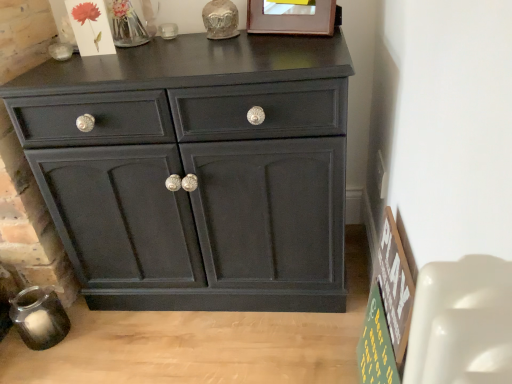
Question: Are wooden picture frame at upper center and matte black cabinet at center located far from each other?

Choices:
 (A) no
 (B) yes

Answer: (A)

Question: Considering the relative sizes of wooden picture frame at upper center and matte black cabinet at center in the image provided, is wooden picture frame at upper center wider than matte black cabinet at center?

Choices:
 (A) no
 (B) yes

Answer: (A)

Question: Is the position of wooden picture frame at upper center less distant than that of matte black cabinet at center?

Choices:
 (A) no
 (B) yes

Answer: (A)

Question: Is wooden picture frame at upper center located outside matte black cabinet at center?

Choices:
 (A) no
 (B) yes

Answer: (B)

Question: Does wooden picture frame at upper center contain matte black cabinet at center?

Choices:
 (A) yes
 (B) no

Answer: (B)

Question: Is wooden picture frame at upper center in front of or behind matte black cabinet at center in the image?

Choices:
 (A) front
 (B) behind

Answer: (B)

Question: Is wooden picture frame at upper center inside or outside of matte black cabinet at center?

Choices:
 (A) inside
 (B) outside

Answer: (B)

Question: From a real-world perspective, relative to matte black cabinet at center, is wooden picture frame at upper center vertically above or below?

Choices:
 (A) below
 (B) above

Answer: (B)

Question: From the image's perspective, is wooden picture frame at upper center positioned above or below matte black cabinet at center?

Choices:
 (A) above
 (B) below

Answer: (A)

Question: Considering the positions of green wooden signboard at lower right and wooden picture frame at upper center in the image, is green wooden signboard at lower right wider or thinner than wooden picture frame at upper center?

Choices:
 (A) wide
 (B) thin

Answer: (B)

Question: Looking at the image, does green wooden signboard at lower right seem bigger or smaller compared to wooden picture frame at upper center?

Choices:
 (A) small
 (B) big

Answer: (B)

Question: Considering the relative positions of green wooden signboard at lower right and wooden picture frame at upper center in the image provided, is green wooden signboard at lower right to the left or to the right of wooden picture frame at upper center?

Choices:
 (A) right
 (B) left

Answer: (A)

Question: Do you think green wooden signboard at lower right is within wooden picture frame at upper center, or outside of it?

Choices:
 (A) inside
 (B) outside

Answer: (B)

Question: Is matte black cabinet at center taller or shorter than wooden picture frame at upper center?

Choices:
 (A) short
 (B) tall

Answer: (B)

Question: Based on their sizes in the image, would you say matte black cabinet at center is bigger or smaller than wooden picture frame at upper center?

Choices:
 (A) small
 (B) big

Answer: (B)